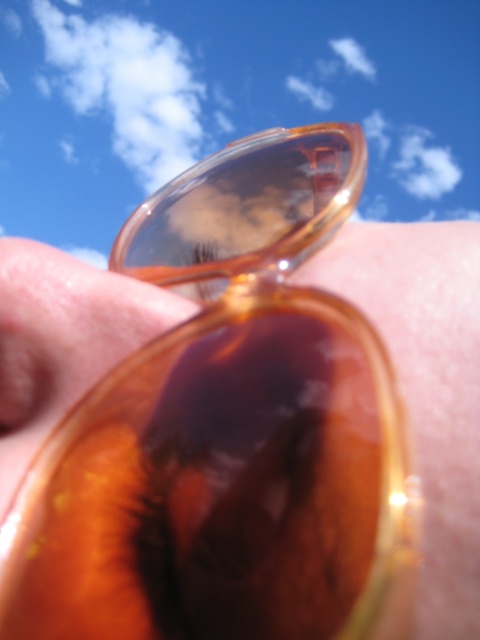
Question: Does translucent amber sunglasses at center have a greater width compared to translucent amber lens at center?

Choices:
 (A) yes
 (B) no

Answer: (A)

Question: Among these objects, which one is nearest to the camera?

Choices:
 (A) translucent amber lens at center
 (B) translucent amber sunglasses at center

Answer: (B)

Question: Is translucent amber sunglasses at center to the left of translucent amber lens at center from the viewer's perspective?

Choices:
 (A) no
 (B) yes

Answer: (A)

Question: Which object is closer to the camera taking this photo?

Choices:
 (A) translucent amber sunglasses at center
 (B) translucent amber lens at center

Answer: (A)

Question: Can you confirm if translucent amber sunglasses at center is bigger than translucent amber lens at center?

Choices:
 (A) no
 (B) yes

Answer: (B)